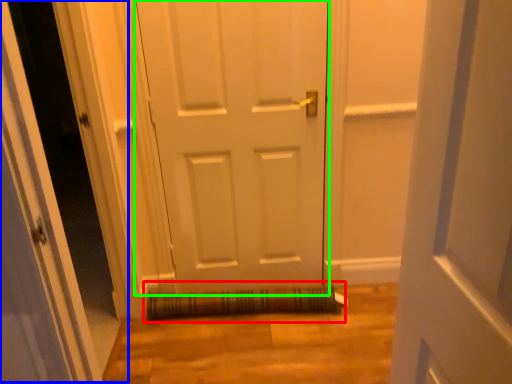
Question: Considering the real-world distances, which object is farthest from doormat (highlighted by a red box)? glass door (highlighted by a blue box) or door (highlighted by a green box)?

Choices:
 (A) glass door
 (B) door

Answer: (A)